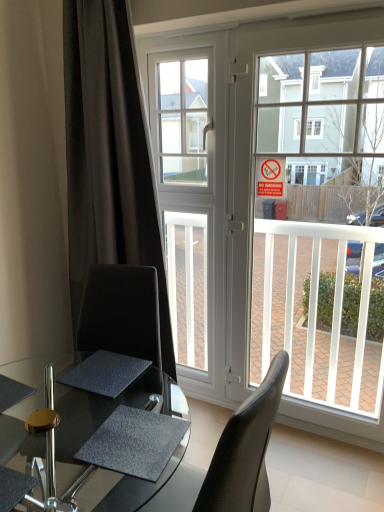
Question: Is clear glass door at center in front of or behind transparent glass table at center in the image?

Choices:
 (A) behind
 (B) front

Answer: (A)

Question: From the image's perspective, is clear glass door at center positioned above or below transparent glass table at center?

Choices:
 (A) above
 (B) below

Answer: (A)

Question: Which of these objects is positioned farthest from the dark matte curtain at left?

Choices:
 (A) clear glass door at center
 (B) transparent glass table at center
 (C) red paper sign at upper center
 (D) white glass window at center

Answer: (B)

Question: Which object is positioned farthest from the transparent glass table at center?

Choices:
 (A) clear glass door at center
 (B) white glass window at center
 (C) red paper sign at upper center
 (D) dark matte curtain at left

Answer: (B)